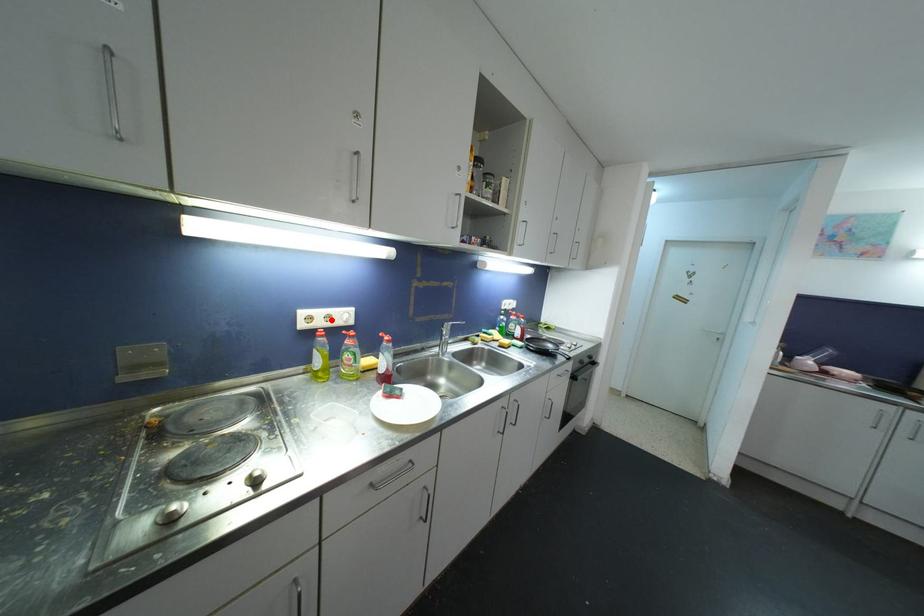
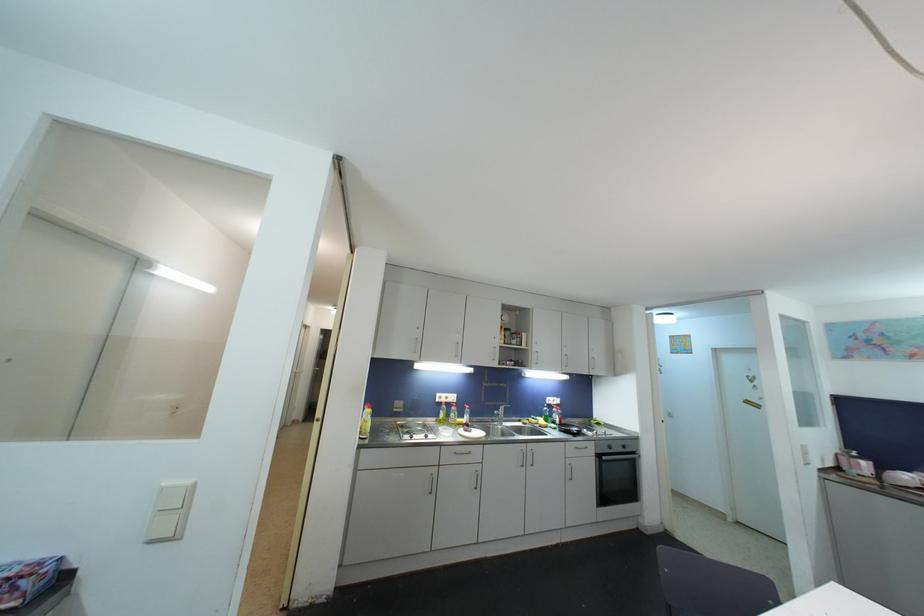
Question: I am providing you with two images of the same scene from different viewpoints. Image1 has a red point marked. In image2, the corresponding 3D location appears at what relative position? Reply with the corresponding letter.

Choices:
 (A) Closer
 (B) Farther

Answer: (B)